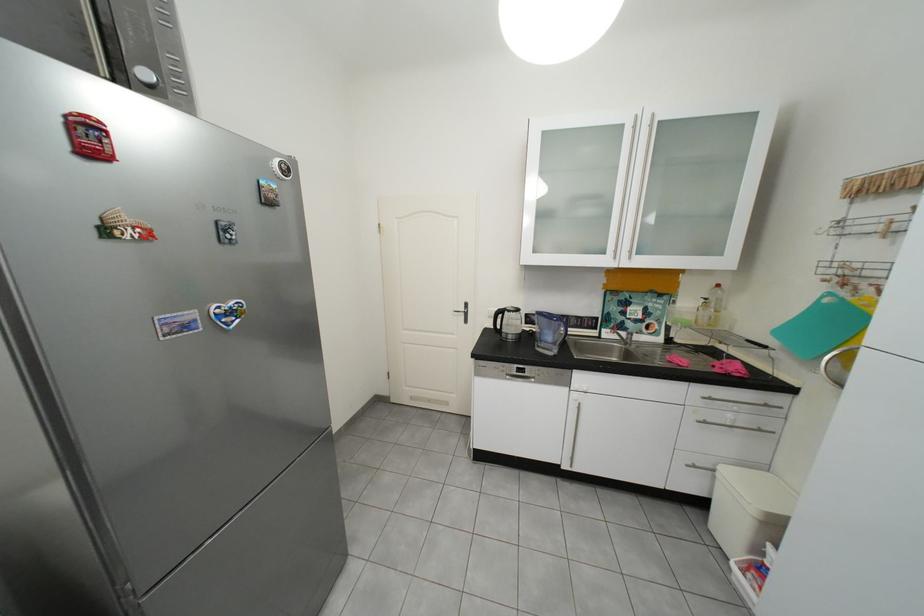
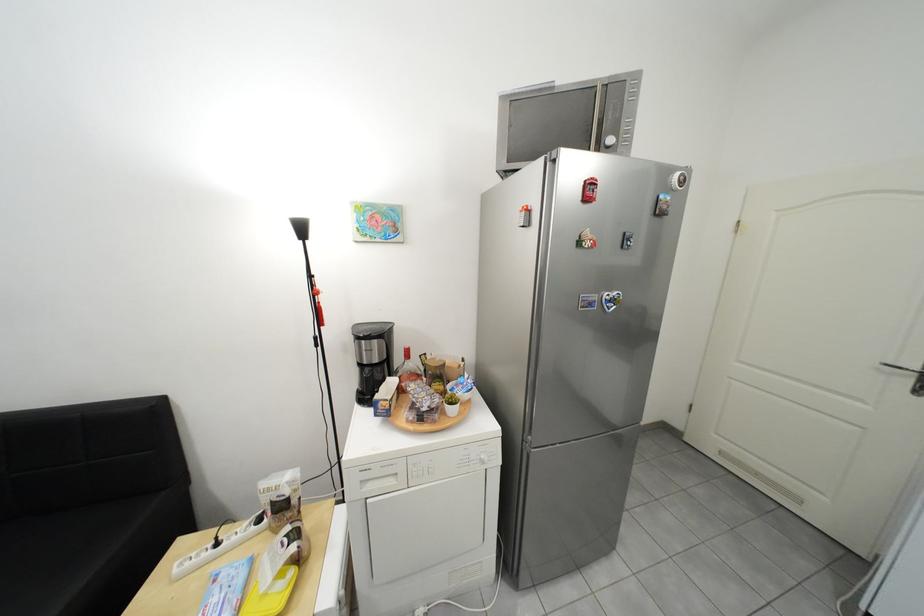
Question: Based on the continuous images, in which direction is the camera rotating? Reply with the corresponding letter.

Choices:
 (A) Left
 (B) Right
 (C) Up
 (D) Down

Answer: (A)